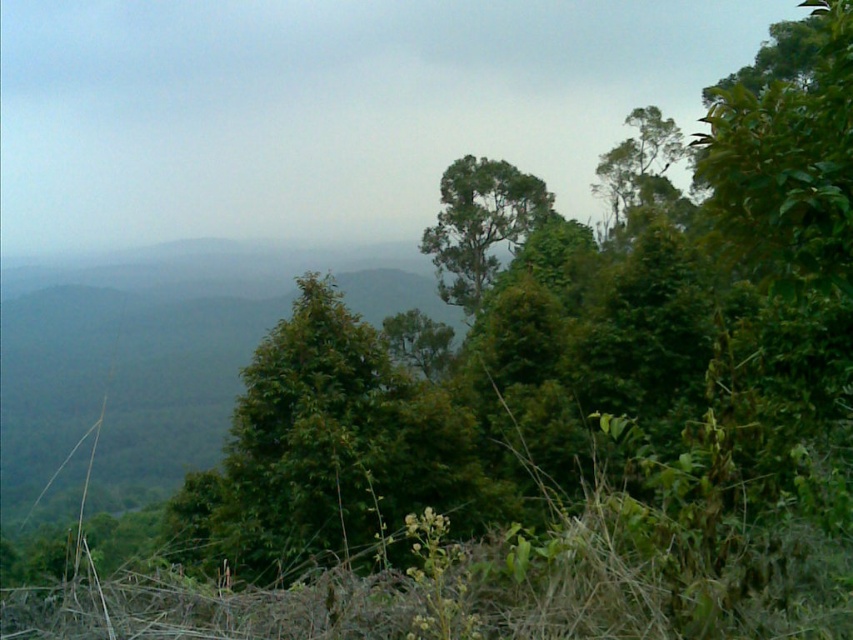
Who is positioned more to the right, green leafy tree at center or green leafy tree at upper right?

Positioned to the right is green leafy tree at upper right.

Measure the distance between green leafy tree at center and green leafy tree at upper right.

green leafy tree at center and green leafy tree at upper right are 10.37 meters apart from each other.

Does point (456, 268) come closer to viewer compared to point (685, 148)?

Yes, point (456, 268) is in front of point (685, 148).

Find the location of a particular element. This screenshot has height=640, width=853. green leafy tree at center is located at coordinates (479, 224).